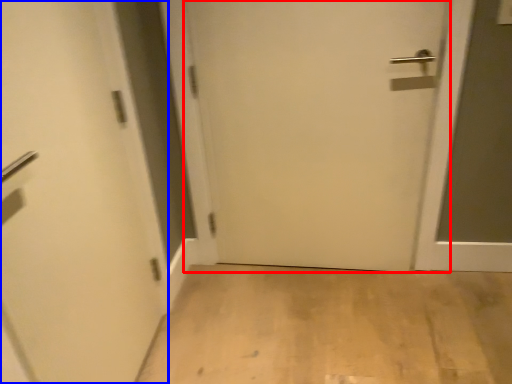
Question: Which of the following is the closest to the observer, door (highlighted by a red box) or door (highlighted by a blue box)?

Choices:
 (A) door
 (B) door

Answer: (B)